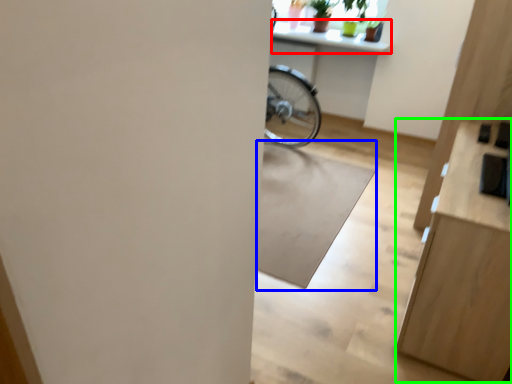
Question: Which object is positioned farthest from counter top (highlighted by a red box)? Select from mat (highlighted by a blue box) and dresser (highlighted by a green box).

Choices:
 (A) mat
 (B) dresser

Answer: (B)